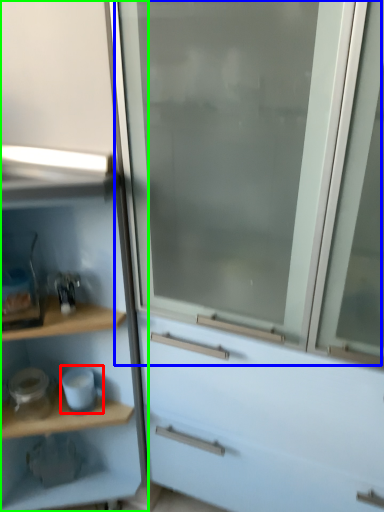
Question: Which object is the closest to the appliance (highlighted by a red box)? Choose among these: screen door (highlighted by a blue box) or cupboard (highlighted by a green box).

Choices:
 (A) screen door
 (B) cupboard

Answer: (B)